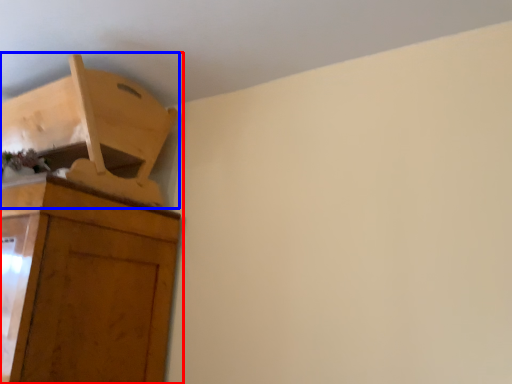
Question: Which of the following is the closest to the observer, cupboard (highlighted by a red box) or furniture (highlighted by a blue box)?

Choices:
 (A) cupboard
 (B) furniture

Answer: (A)